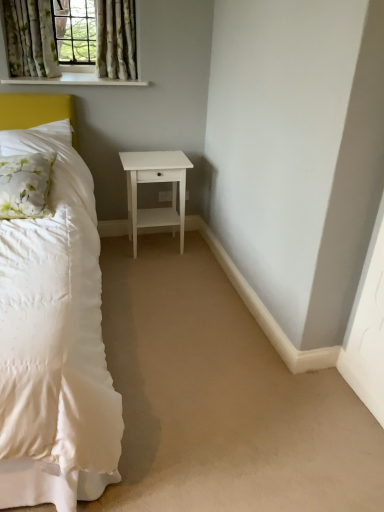
Question: In terms of width, does white plastic electric outlet at center look wider or thinner when compared to white painted wood at upper left?

Choices:
 (A) wide
 (B) thin

Answer: (B)

Question: Would you say white plastic electric outlet at center is to the left or to the right of white painted wood at upper left in the picture?

Choices:
 (A) left
 (B) right

Answer: (B)

Question: Considering the real-world distances, which object is farthest from the floral fabric curtain at upper left, which is the 2th curtain in left-to-right order?

Choices:
 (A) white plastic electric outlet at center
 (B) white painted wood at upper left
 (C) white matte nightstand at center
 (D) white floral fabric pillow at left
 (E) floral fabric curtain at upper left

Answer: (D)

Question: Which object is the closest to the white floral fabric pillow at left?

Choices:
 (A) white plastic electric outlet at center
 (B) floral fabric curtain at upper left, which is the 2th curtain in left-to-right order
 (C) white painted wood at upper left
 (D) floral fabric curtain at upper left
 (E) floral fabric curtain at upper left, which is the 1th curtain from left to right

Answer: (C)